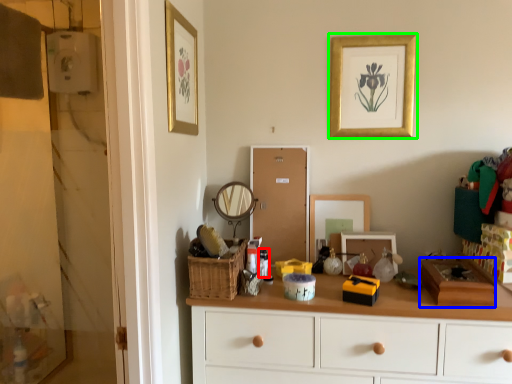
Question: Estimate the real-world distances between objects in this image. Which object is farther from toiletry (highlighted by a red box), box (highlighted by a blue box) or picture frame (highlighted by a green box)?

Choices:
 (A) box
 (B) picture frame

Answer: (B)